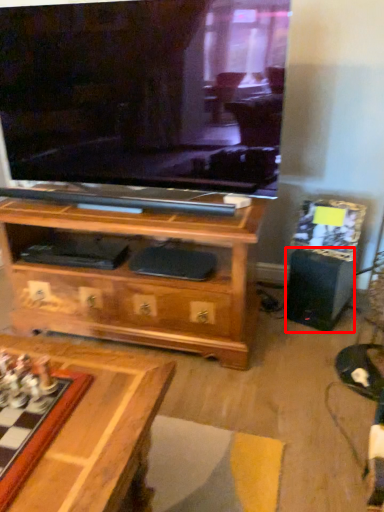
Question: Considering the relative positions of speaker (annotated by the red box) and board game in the image provided, where is speaker (annotated by the red box) located with respect to the staircase?

Choices:
 (A) left
 (B) right

Answer: (B)